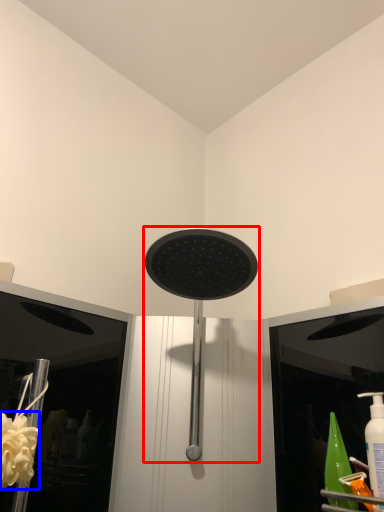
Question: Which point is closer to the camera, shower (highlighted by a red box) or flower (highlighted by a blue box)?

Choices:
 (A) shower
 (B) flower

Answer: (A)